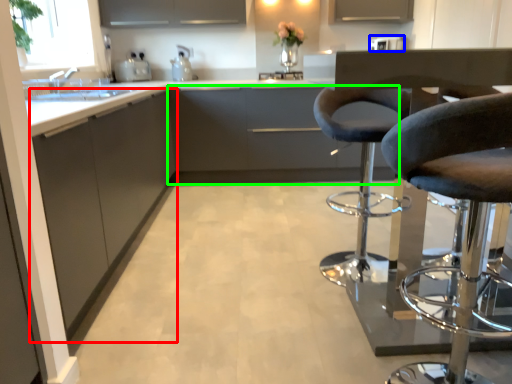
Question: Which object is positioned farthest from cabinetry (highlighted by a red box)? Select from appliance (highlighted by a blue box) and cabinetry (highlighted by a green box).

Choices:
 (A) appliance
 (B) cabinetry

Answer: (A)